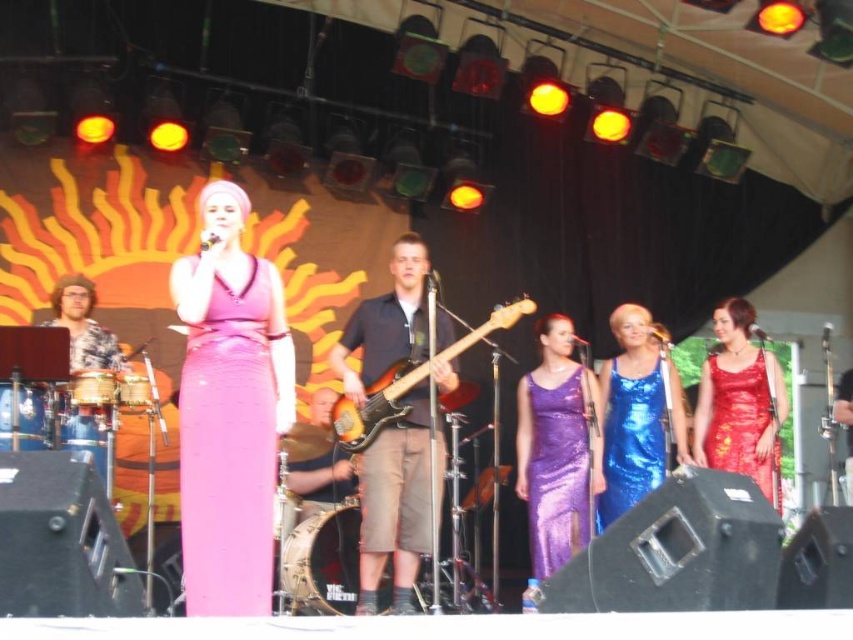
You are a stagehand who needs to move the shiny blue dress at center and the brown leather drum at center closer together so that they are only 1.5 meters apart. Given their current distance, can you achieve this by moving both objects towards each other?

The shiny blue dress at center and brown leather drum at center are currently 1.88 meters apart. To reduce the distance to 1.5 meters, you need to move them a combined total of 0.38 meters toward each other. Since both objects can be moved independently, this adjustment is feasible.

Consider the image. You are a stagehand who needs to adjust the lighting for the performer. The spotlight currently illuminates the dark blue fabric shirt at center and the brown wood guitar at center. Since the shirt is taller than the guitar, which object should you adjust the spotlight to focus on first to ensure both are properly lit?

The dark blue fabric shirt at center is taller than the brown wood guitar at center, so you should adjust the spotlight to focus on the dark blue fabric shirt at center first to ensure proper lighting given its height advantage.